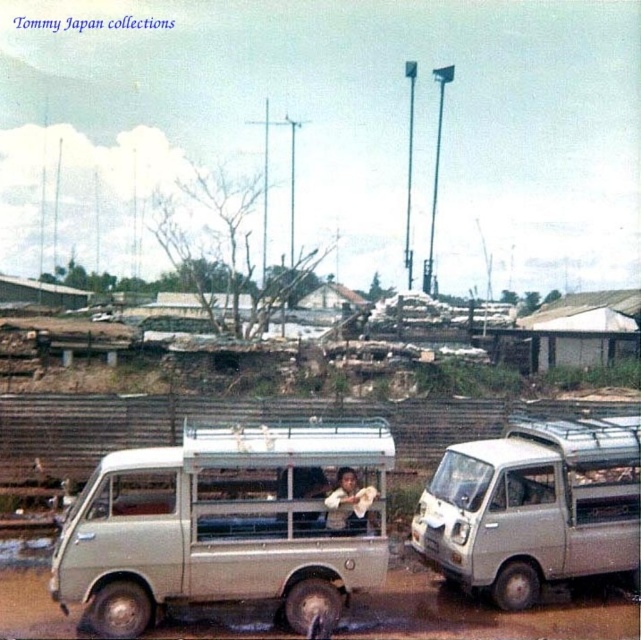
Question: Does beige matte van at center come in front of silver metallic van at center?

Choices:
 (A) yes
 (B) no

Answer: (A)

Question: Among these points, which one is farthest from the camera?

Choices:
 (A) (329, 532)
 (B) (635, 440)

Answer: (B)

Question: Can you confirm if beige matte van at center is thinner than silver metallic van at center?

Choices:
 (A) yes
 (B) no

Answer: (B)

Question: Is beige matte van at center positioned at the back of silver metallic van at center?

Choices:
 (A) yes
 (B) no

Answer: (B)

Question: Which point is closer to the camera?

Choices:
 (A) (453, 502)
 (B) (281, 541)

Answer: (B)